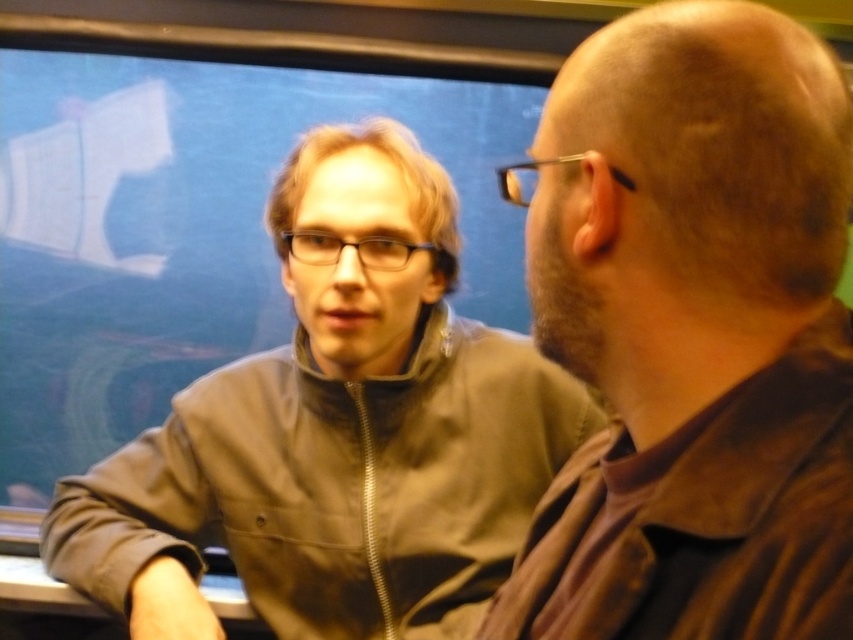
Question: Which point is farther from the camera taking this photo?

Choices:
 (A) (584, 369)
 (B) (409, 184)

Answer: (B)

Question: Can you confirm if brown leather jacket at right is positioned to the right of matte gray jacket at center?

Choices:
 (A) yes
 (B) no

Answer: (A)

Question: Is brown leather jacket at right further to the viewer compared to matte gray jacket at center?

Choices:
 (A) yes
 (B) no

Answer: (B)

Question: Does brown leather jacket at right have a greater width compared to matte gray jacket at center?

Choices:
 (A) yes
 (B) no

Answer: (B)